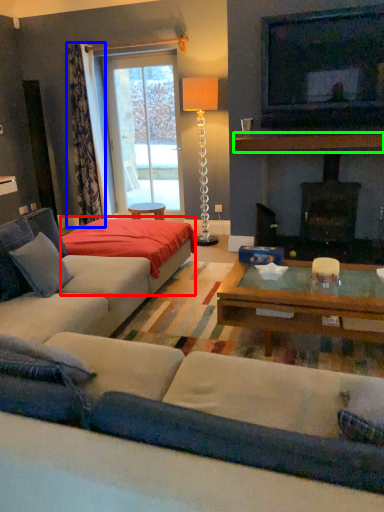
Question: Which object is the closest to the plain (highlighted by a red box)? Choose among these: curtain (highlighted by a blue box) or mantle (highlighted by a green box).

Choices:
 (A) curtain
 (B) mantle

Answer: (B)